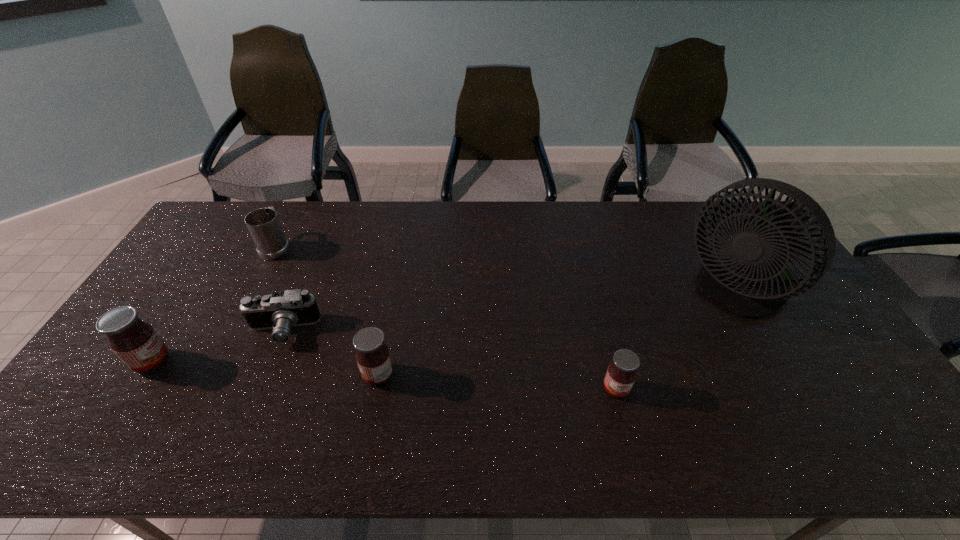
Find the location of a particular element. Image resolution: width=960 pixels, height=540 pixels. the leftmost jam is located at coordinates [137, 344].

Where is `the fourth object from left to right`? the fourth object from left to right is located at coordinates (373, 357).

Image resolution: width=960 pixels, height=540 pixels. Find the location of `the second tallest jam`. the second tallest jam is located at coordinates (373, 357).

Find the location of a particular element. the shortest jam is located at coordinates (621, 373).

The width and height of the screenshot is (960, 540). In order to click on the rightmost jam in this screenshot , I will do `click(621, 373)`.

The image size is (960, 540). In order to click on mug in this screenshot , I will do `click(263, 224)`.

At what (x,y) coordinates should I click in order to perform the action: click on camera. Please return your answer as a coordinate pair (x, y). The height and width of the screenshot is (540, 960). Looking at the image, I should click on (279, 311).

Where is `the tallest object`? Image resolution: width=960 pixels, height=540 pixels. the tallest object is located at coordinates (743, 282).

This screenshot has height=540, width=960. Find the location of `fan`. fan is located at coordinates (743, 282).

This screenshot has height=540, width=960. What are the coordinates of `vacant space located 0.080m on the label side of the leftmost jam` in the screenshot? It's located at (201, 362).